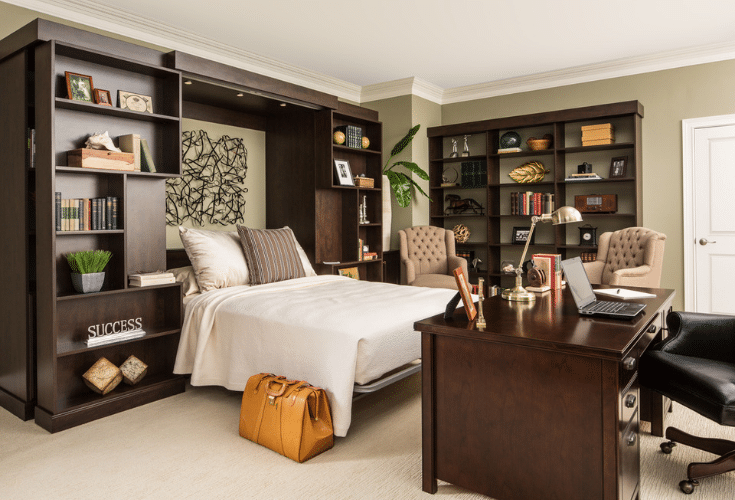
Where is `modern room`? The width and height of the screenshot is (735, 500). modern room is located at coordinates (182, 429).